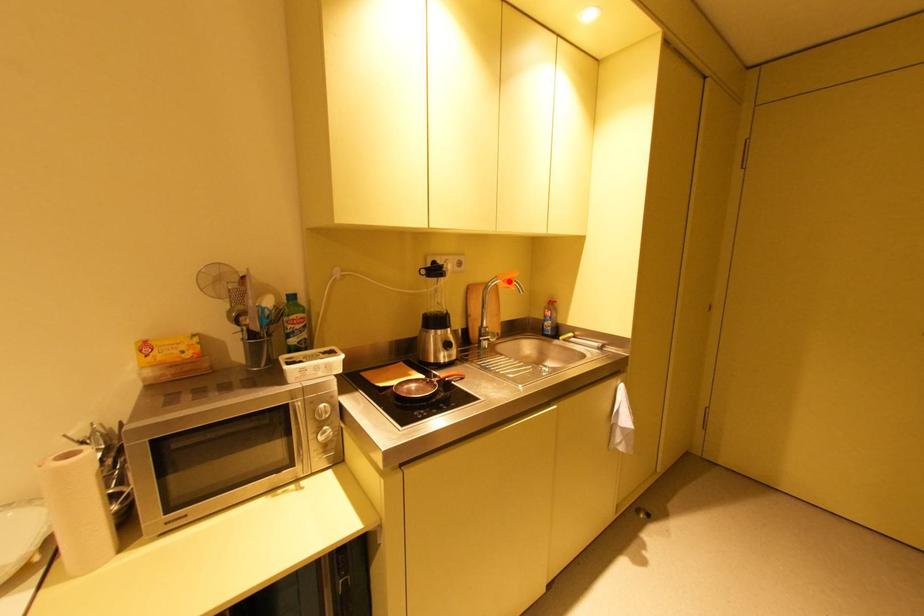
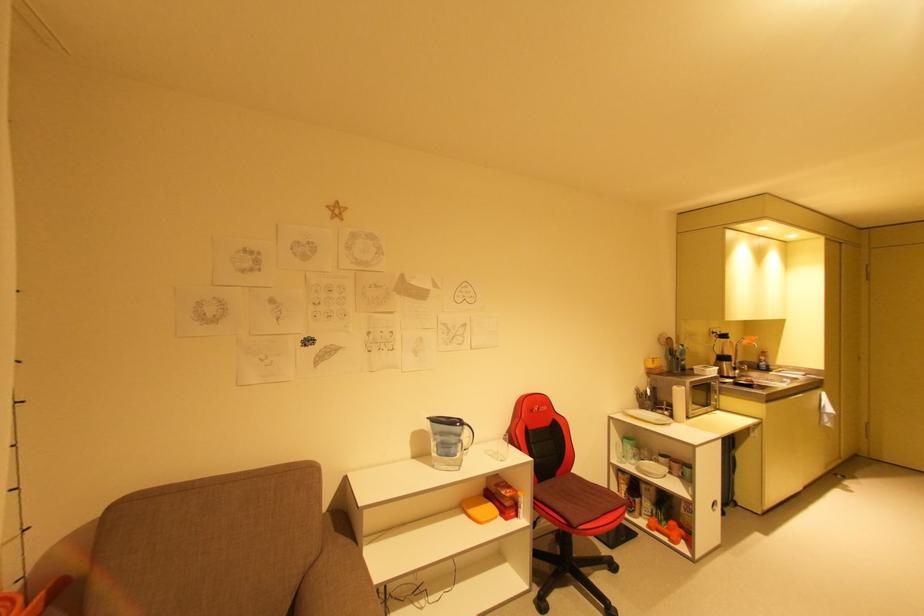
The point at the highlighted location is marked in the first image. Where is the corresponding point in the second image?

(756, 341)